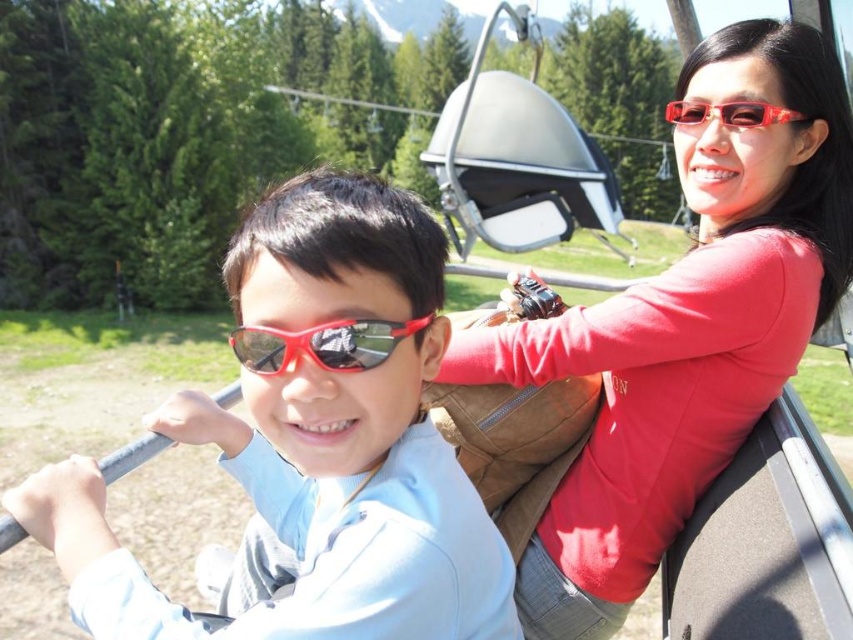
Consider the image. Which is above, matte blue shirt at center or matte red sweater at upper right?

matte red sweater at upper right is higher up.

Is point (375, 346) positioned after point (531, 323)?

No, (375, 346) is closer to viewer.

You are a GUI agent. You are given a task and a screenshot of the screen. Output one action in this format:
    pyautogui.click(x=<x>, y=<y>)
    Task: Click on the matte blue shirt at center
    This screenshot has width=853, height=640.
    Given the screenshot: What is the action you would take?
    pyautogui.click(x=314, y=440)

Between matte blue shirt at center and matte red sunglasses at center, which one appears on the left side from the viewer's perspective?

matte blue shirt at center

Who is more distant from viewer, (x=267, y=284) or (x=268, y=362)?

The point (x=267, y=284) is behind.

Where is `matte blue shirt at center`? Image resolution: width=853 pixels, height=640 pixels. matte blue shirt at center is located at coordinates (314, 440).

This screenshot has height=640, width=853. I want to click on matte blue shirt at center, so [314, 440].

Who is positioned more to the right, matte red sweater at upper right or matte red sunglasses at center?

From the viewer's perspective, matte red sweater at upper right appears more on the right side.

Is matte red sweater at upper right smaller than matte red sunglasses at center?

Actually, matte red sweater at upper right might be larger than matte red sunglasses at center.

Based on the photo, who is more forward, (804, 189) or (401, 330)?

Answer: Positioned in front is point (401, 330).

Locate an element on the screen. matte red sweater at upper right is located at coordinates (688, 326).